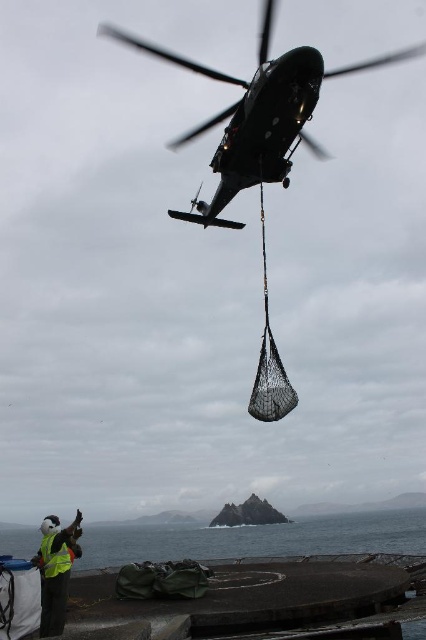
Question: Among these objects, which one is nearest to the camera?

Choices:
 (A) black rubber water at lower center
 (B) reflective yellow vest at lower left

Answer: (B)

Question: Which of these objects is positioned farthest from the metallic dark green helicopter at upper center?

Choices:
 (A) reflective yellow vest at lower left
 (B) yellow reflective safety vest at lower left

Answer: (A)

Question: Does metallic dark green helicopter at upper center lie behind yellow reflective safety vest at lower left?

Choices:
 (A) yes
 (B) no

Answer: (A)

Question: Which is farther from the metallic dark green helicopter at upper center?

Choices:
 (A) reflective yellow vest at lower left
 (B) yellow reflective safety vest at lower left
 (C) black rubber water at lower center

Answer: (C)

Question: Does metallic dark green helicopter at upper center appear on the left side of black rubber water at lower center?

Choices:
 (A) no
 (B) yes

Answer: (A)

Question: Observing the image, what is the correct spatial positioning of black rubber water at lower center in reference to yellow reflective safety vest at lower left?

Choices:
 (A) left
 (B) right

Answer: (B)